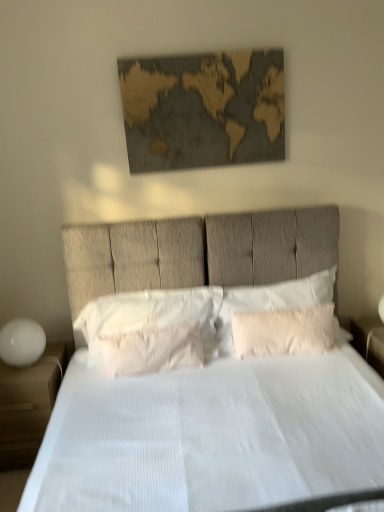
Question: In terms of size, does white textured pillow at center, the third pillow from the right, appear bigger or smaller than gold textured map at upper center?

Choices:
 (A) big
 (B) small

Answer: (A)

Question: From a real-world perspective, is white textured pillow at center, which appears as the 1th pillow when viewed from the left, physically located above or below gold textured map at upper center?

Choices:
 (A) below
 (B) above

Answer: (A)

Question: Based on their relative distances, which object is nearer to the white textured bed at center?

Choices:
 (A) gold textured map at upper center
 (B) white matte nightstand at lower left, arranged as the second nightstand when viewed from the right
 (C) white glossy nightstand at right, the 2th nightstand from the left
 (D) white textured pillow at center, the 2th pillow from the left
 (E) white textured pillow at center, the third pillow from the right

Answer: (D)

Question: Which object is positioned closest to the white glossy nightstand at right, placed as the first nightstand when sorted from right to left?

Choices:
 (A) white matte nightstand at lower left, which is counted as the first nightstand, starting from the left
 (B) white textured pillow at center, arranged as the third pillow when viewed from the left
 (C) gold textured map at upper center
 (D) white textured pillow at center, the 2th pillow positioned from the right
 (E) white glossy sphere at left

Answer: (B)